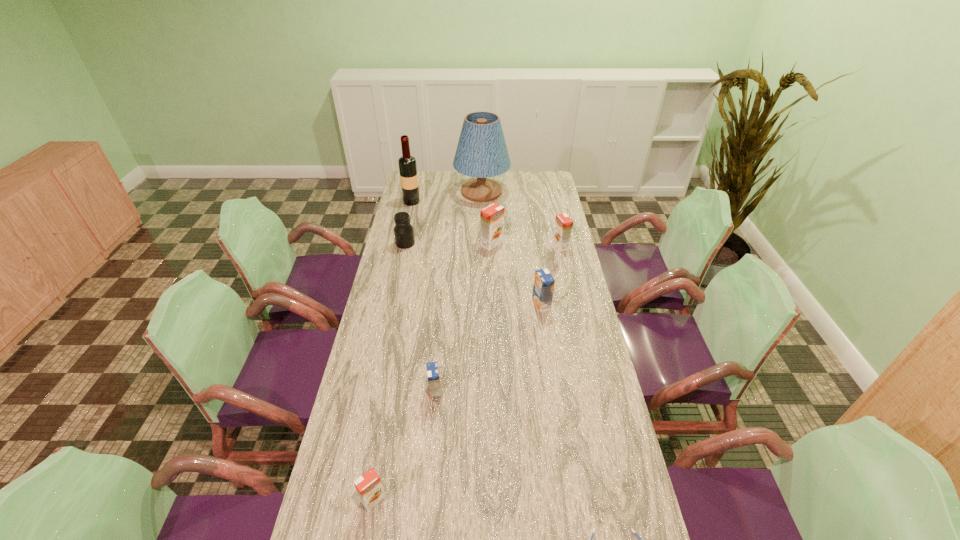
Image resolution: width=960 pixels, height=540 pixels. Identify the location of the nearer blue orange_juice. (432, 368).

I want to click on the nearest orange orange juice, so click(x=369, y=487).

Image resolution: width=960 pixels, height=540 pixels. What are the coordinates of `the nearest orange juice` in the screenshot? It's located at (369, 487).

The width and height of the screenshot is (960, 540). Find the location of `free space located on the front of the lampshade`. free space located on the front of the lampshade is located at coordinates (482, 242).

The height and width of the screenshot is (540, 960). Identify the location of free location located on the right of the wine bottle. (456, 201).

At what (x,y) coordinates should I click in order to perform the action: click on vacant space located on the right of the second orange orange juice from right to left. Please return your answer as a coordinate pair (x, y). Image resolution: width=960 pixels, height=540 pixels. Looking at the image, I should click on (567, 244).

Locate an element on the screen. The image size is (960, 540). free location located 0.390m on the front of the jar is located at coordinates (391, 314).

Where is `vacant area located on the back of the right blue orange_juice`? This screenshot has width=960, height=540. vacant area located on the back of the right blue orange_juice is located at coordinates (538, 280).

Where is `vacant space situated 0.060m on the back of the rightmost orange juice`? vacant space situated 0.060m on the back of the rightmost orange juice is located at coordinates (558, 232).

What are the coordinates of `free location located 0.290m on the back of the second orange juice from left to right` in the screenshot? It's located at (442, 317).